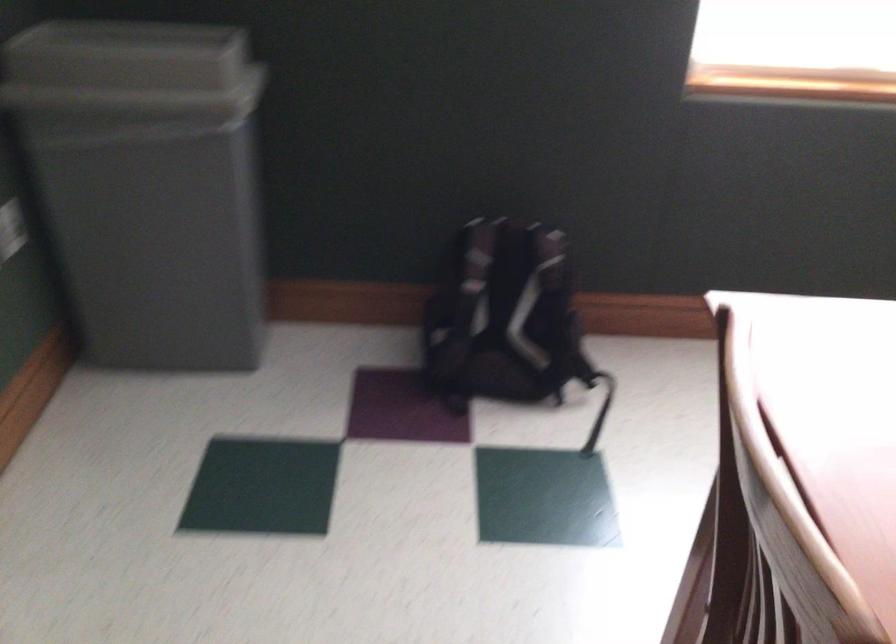
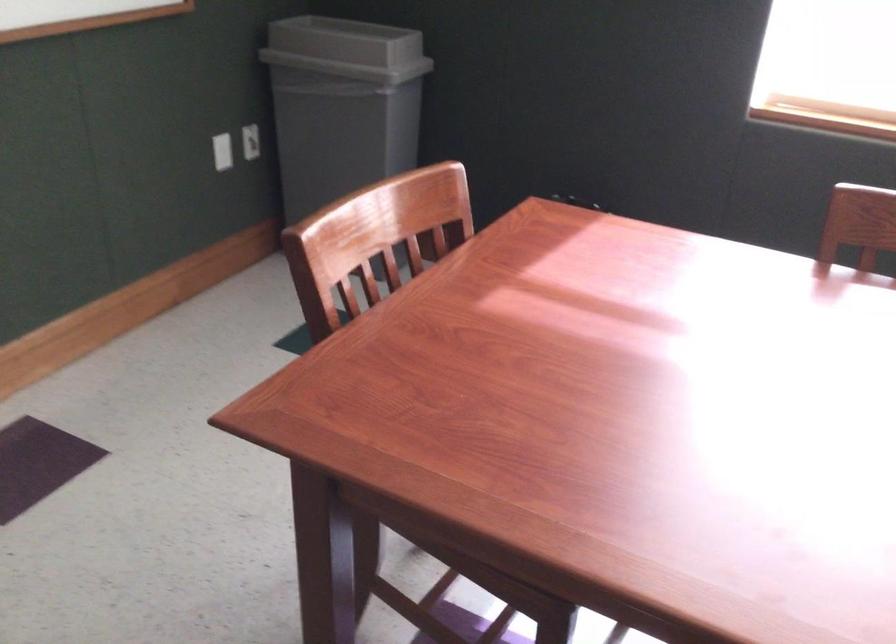
Which direction would the cameraman need to move to produce the second image?

The movement direction of the cameraman is right, backward.